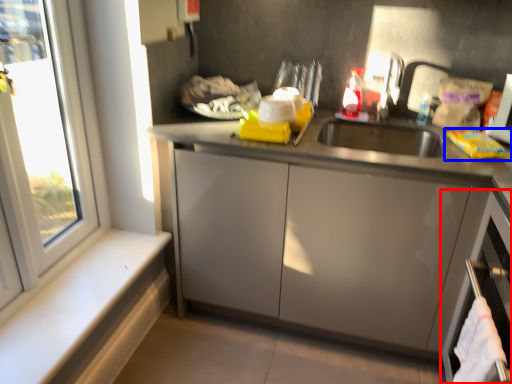
Question: Which object appears farthest to the camera in this image, dish washer (highlighted by a red box) or food (highlighted by a blue box)?

Choices:
 (A) dish washer
 (B) food

Answer: (B)